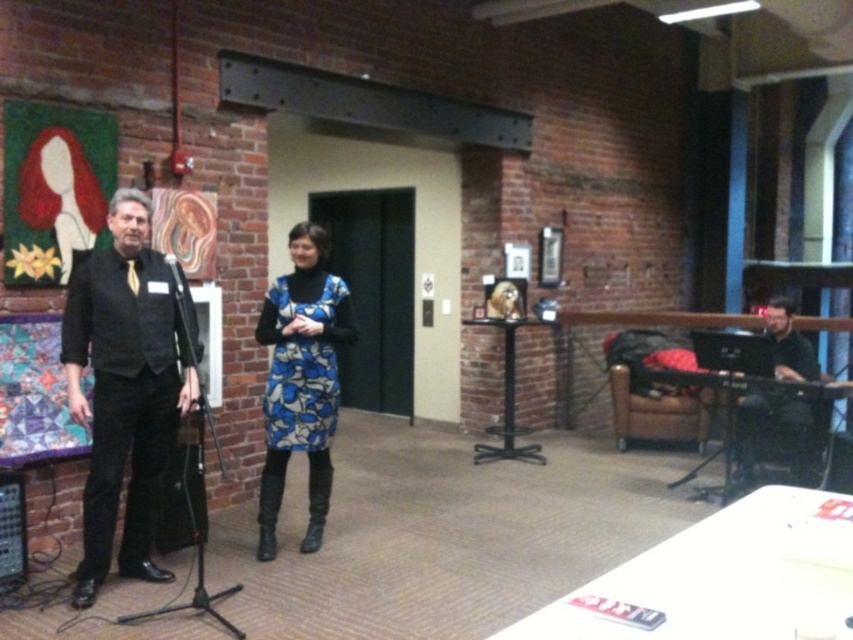
Between black textured suit at left and black matte microphone at left, which one appears on the right side from the viewer's perspective?

black matte microphone at left is more to the right.

Is black textured suit at left above black matte microphone at left?

No, black textured suit at left is not above black matte microphone at left.

Identify the location of black textured suit at left. The width and height of the screenshot is (853, 640). (125, 388).

Between point (73, 336) and point (312, 241), which one is positioned in front?

Point (73, 336) is more forward.

Between black textured suit at left and blue printed dress at center, which one is positioned lower?

Positioned lower is blue printed dress at center.

Between point (148, 522) and point (276, 508), which one is positioned behind?

Point (276, 508)

You are a GUI agent. You are given a task and a screenshot of the screen. Output one action in this format:
    pyautogui.click(x=<x>, y=<y>)
    Task: Click on the black textured suit at left
    The height and width of the screenshot is (640, 853).
    Given the screenshot: What is the action you would take?
    pyautogui.click(x=125, y=388)

Is black textured suit at left above black matte laptop at right?

Yes, black textured suit at left is above black matte laptop at right.

The image size is (853, 640). What do you see at coordinates (125, 388) in the screenshot? I see `black textured suit at left` at bounding box center [125, 388].

Identify the location of black textured suit at left. The image size is (853, 640). (125, 388).